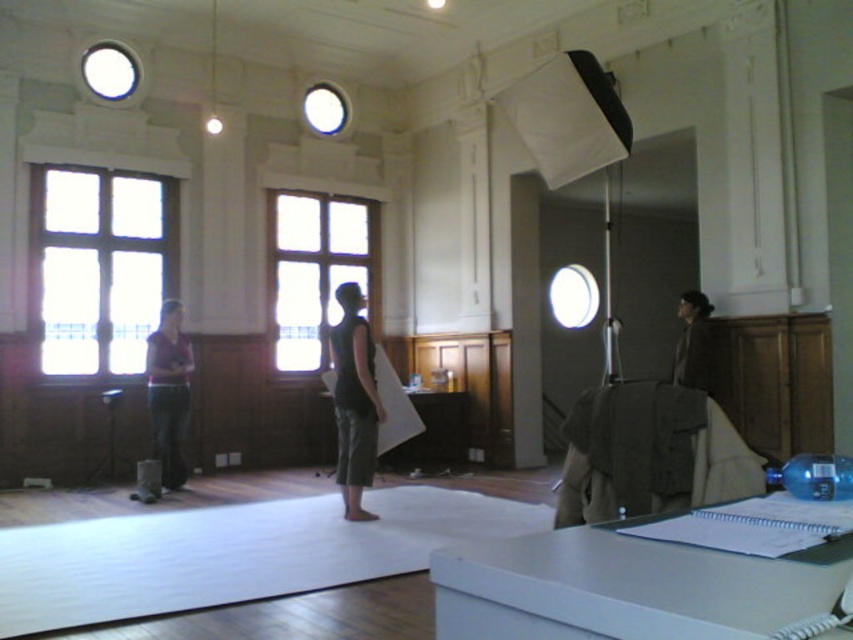
Question: Which is farther from the clear glass window at center?

Choices:
 (A) brown woolen jacket at upper right
 (B) clear glass window at left
 (C) black matte tank top at center

Answer: (A)

Question: Among these points, which one is farthest from the camera?

Choices:
 (A) (346, 516)
 (B) (314, 300)
 (C) (161, 240)
 (D) (682, 378)

Answer: (B)

Question: Does clear glass window at left appear on the right side of black matte tank top at center?

Choices:
 (A) yes
 (B) no

Answer: (B)

Question: Which point is closer to the camera?

Choices:
 (A) coord(68,328)
 (B) coord(676,353)
 (C) coord(321,212)
 (D) coord(355,410)

Answer: (D)

Question: Is clear glass window at left bigger than clear glass window at center?

Choices:
 (A) yes
 (B) no

Answer: (B)

Question: Observing the image, what is the correct spatial positioning of black matte tank top at center in reference to brown woolen jacket at upper right?

Choices:
 (A) above
 (B) below

Answer: (B)